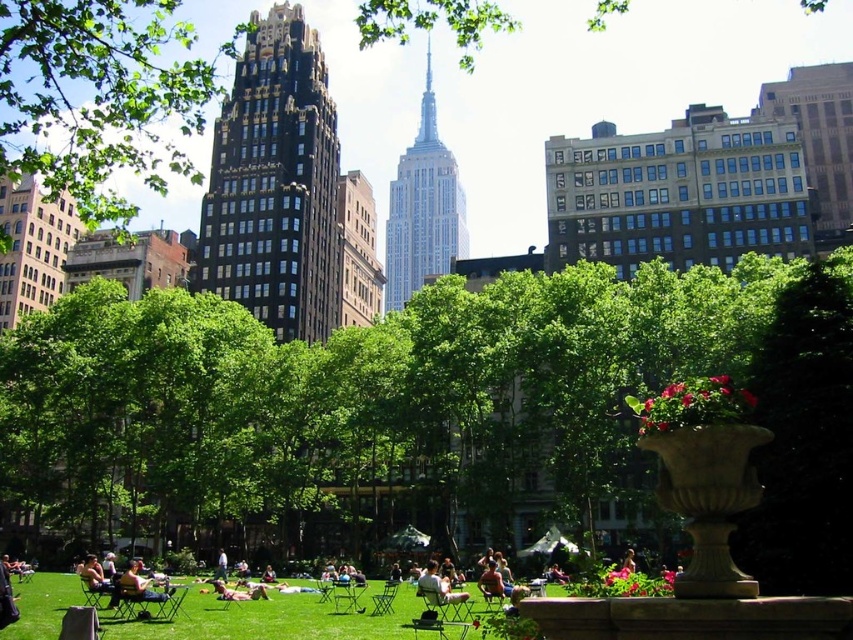
Which is below, light brown wooden chair at center or light brown wooden chair at lower left?

Positioned lower is light brown wooden chair at center.

Is light brown wooden chair at center above light brown wooden chair at lower left?

No, light brown wooden chair at center is not above light brown wooden chair at lower left.

Measure the distance between point (x=445, y=586) and camera.

204.50 feet

Find the location of `light brown wooden chair at center`. light brown wooden chair at center is located at coordinates (437, 586).

Between green leafy tree at left and light brown wooden chair at lower center, which one has more height?

green leafy tree at left

Which of these two, green leafy tree at left or light brown wooden chair at lower center, stands shorter?

light brown wooden chair at lower center

Locate an element on the screen. The image size is (853, 640). green leafy tree at left is located at coordinates (99, 97).

Measure the distance from green grass at center to light brown wooden chair at lower left.

green grass at center is 21.28 feet away from light brown wooden chair at lower left.

Consider the image. Is the position of green grass at center less distant than that of light brown wooden chair at lower left?

Yes.

Which is behind, point (416, 604) or point (134, 588)?

The point (416, 604) is behind.

Find the location of `green grass at center`. green grass at center is located at coordinates (273, 618).